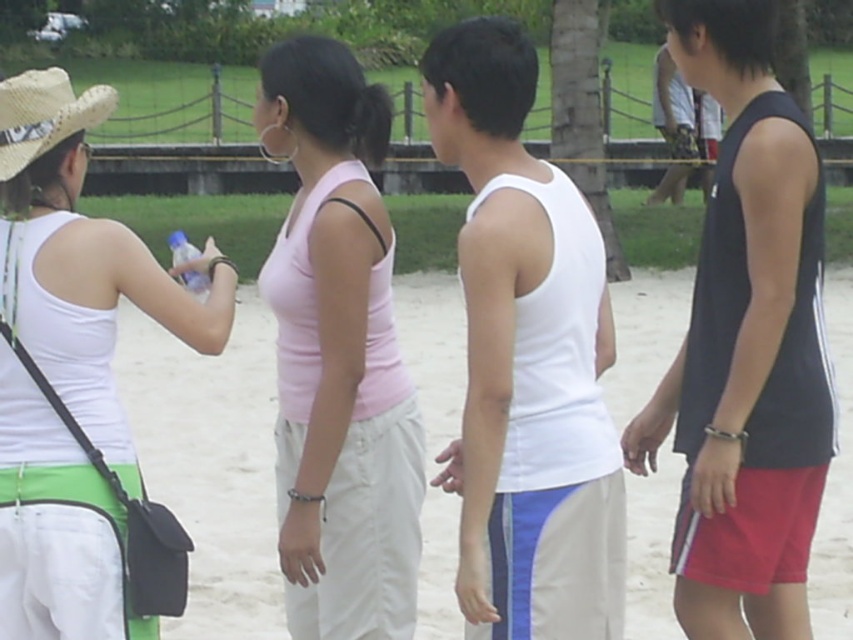
Who is positioned more to the right, beige sand at center or strawmaterial/texturecowboy hat at left?

From the viewer's perspective, beige sand at center appears more on the right side.

Locate an element on the screen. beige sand at center is located at coordinates (210, 461).

Looking at this image, is pink fabric tank top at center below strawmaterial/texturecowboy hat at left?

Yes.

Is point (334, 328) closer to camera compared to point (41, 100)?

No, it is not.

Where is `pink fabric tank top at center`? The image size is (853, 640). pink fabric tank top at center is located at coordinates (338, 355).

Does beige sand at center lie in front of black tank top at upper right?

That is True.

You are a GUI agent. You are given a task and a screenshot of the screen. Output one action in this format:
    pyautogui.click(x=<x>, y=<y>)
    Task: Click on the beige sand at center
    
    Given the screenshot: What is the action you would take?
    pyautogui.click(x=210, y=461)

Does point (660, 580) come in front of point (682, 140)?

Yes, it is in front of point (682, 140).

Locate an element on the screen. The width and height of the screenshot is (853, 640). beige sand at center is located at coordinates (210, 461).